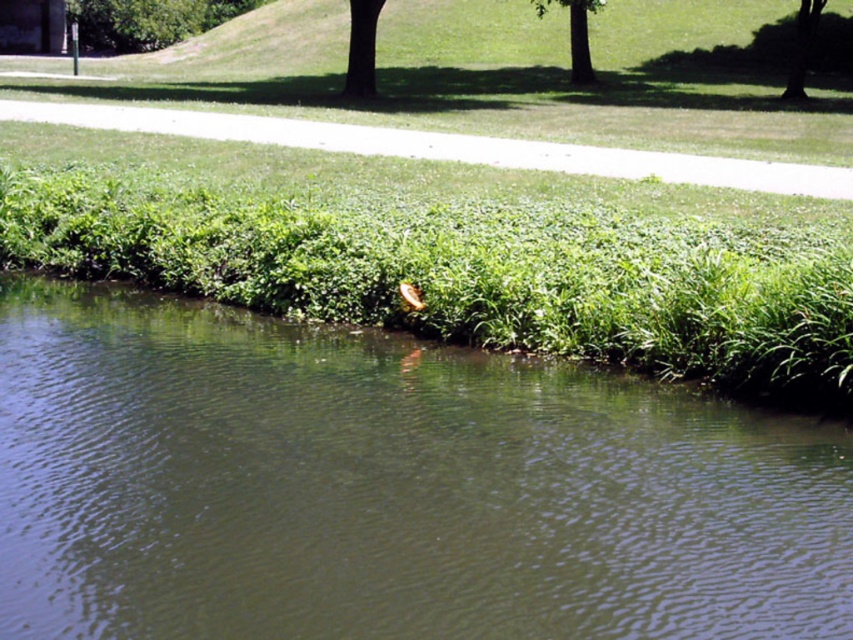
Question: Considering the real-world distances, which object is closest to the dark brown textured tree at upper center?

Choices:
 (A) green grassy river at center
 (B) green leafy tree at upper center

Answer: (B)

Question: Which object appears farthest from the camera in this image?

Choices:
 (A) green leafy tree at upper center
 (B) green leafy tree at upper left
 (C) dark brown textured tree at upper center

Answer: (B)

Question: Does dark brown textured tree at upper center have a lesser width compared to green leafy tree at upper center?

Choices:
 (A) yes
 (B) no

Answer: (A)

Question: Which object is farther from the camera taking this photo?

Choices:
 (A) green leafy tree at upper center
 (B) dark brown textured tree at upper center
 (C) green leafy tree at upper right
 (D) green leafy tree at upper left

Answer: (D)

Question: Is green grassy river at center to the left of green leafy tree at upper center from the viewer's perspective?

Choices:
 (A) no
 (B) yes

Answer: (B)

Question: Can you confirm if green grassy river at center is positioned to the left of green leafy tree at upper right?

Choices:
 (A) no
 (B) yes

Answer: (B)